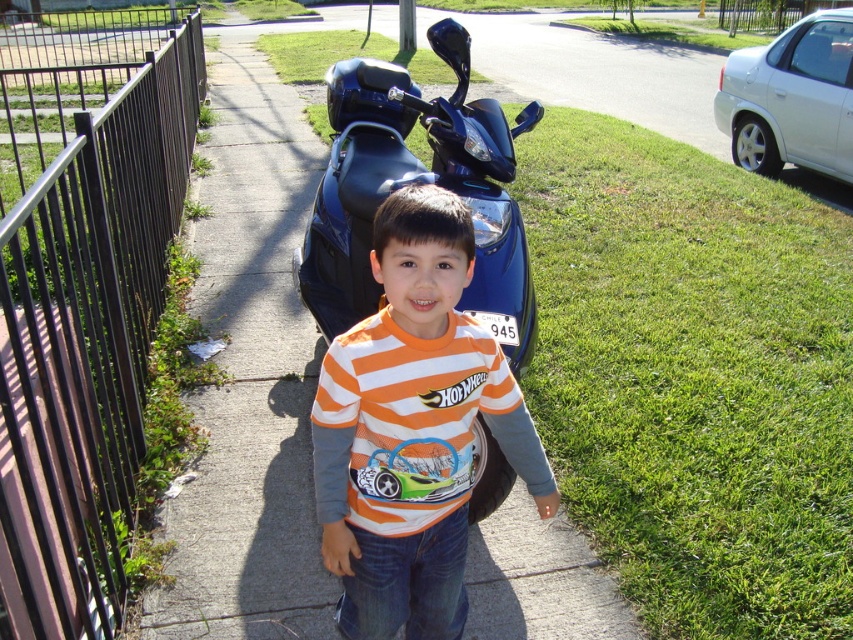
Question: Where is smooth concrete pavement at center located in relation to orange striped shirt at center in the image?

Choices:
 (A) above
 (B) below

Answer: (A)

Question: Is smooth concrete pavement at center closer to the viewer compared to black metal fence at left?

Choices:
 (A) no
 (B) yes

Answer: (A)

Question: Estimate the real-world distances between objects in this image. Which object is closer to the smooth concrete pavement at center?

Choices:
 (A) black metal fence at left
 (B) orange striped shirt at center

Answer: (B)

Question: Which object is farther from the camera taking this photo?

Choices:
 (A) orange striped shirt at center
 (B) black metal fence at left

Answer: (A)

Question: Considering the relative positions of smooth concrete pavement at center and orange striped shirt at center in the image provided, where is smooth concrete pavement at center located with respect to orange striped shirt at center?

Choices:
 (A) above
 (B) below

Answer: (A)

Question: Which of the following is the closest to the observer?

Choices:
 (A) orange striped shirt at center
 (B) black metal fence at left

Answer: (B)